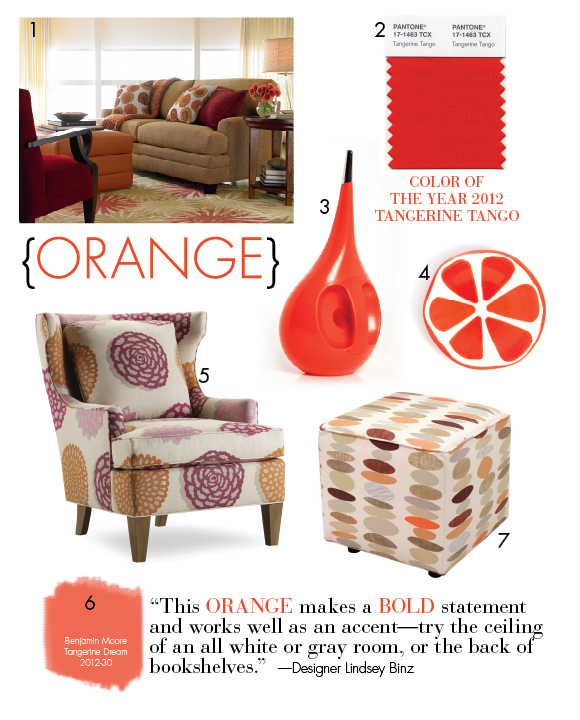
This screenshot has width=580, height=720. In order to click on foot stool in this screenshot , I will do [x=404, y=430].